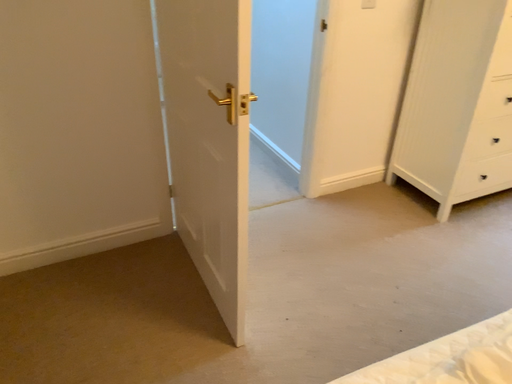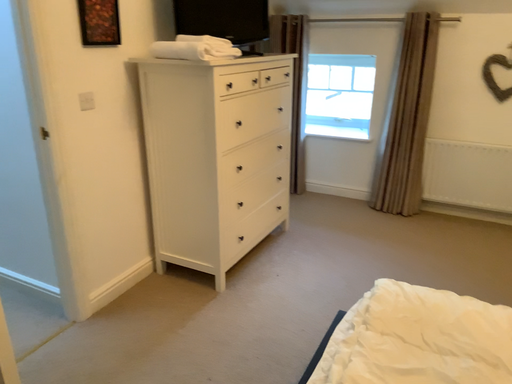
Question: Which way did the camera rotate in the video?

Choices:
 (A) rotated upward
 (B) rotated downward

Answer: (A)